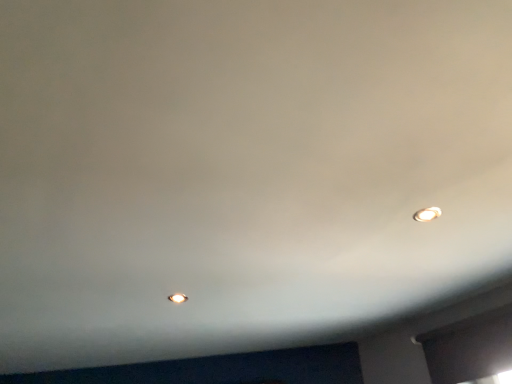
Image resolution: width=512 pixels, height=384 pixels. Describe the element at coordinates (426, 214) in the screenshot. I see `matte white light bulb at upper right, arranged as the 1th light bulb when viewed from the front` at that location.

How much space does matte white light bulb at center, which appears as the first light bulb when ordered from the bottom, occupy horizontally?

matte white light bulb at center, which appears as the first light bulb when ordered from the bottom, is 10.09 centimeters wide.

In order to face matte white light bulb at center, which ranks as the first light bulb in left-to-right order, should I rotate leftwards or rightwards?

You should rotate left by 10.010 degrees.

Find the location of a particular element. This screenshot has width=512, height=384. matte white light bulb at upper right, which is the 2th light bulb in left-to-right order is located at coordinates (x=426, y=214).

Considering the sizes of objects matte white light bulb at upper right, which appears as the second light bulb when ordered from the bottom, and transparent glass window at lower right in the image provided, who is shorter, matte white light bulb at upper right, which appears as the second light bulb when ordered from the bottom, or transparent glass window at lower right?

With less height is matte white light bulb at upper right, which appears as the second light bulb when ordered from the bottom.

Which object is positioned more to the left, matte white light bulb at upper right, the 1th light bulb positioned from the top, or transparent glass window at lower right?

matte white light bulb at upper right, the 1th light bulb positioned from the top, is more to the left.

From the image's perspective, count 2nd light bulbs upward from the transparent glass window at lower right and point to it. Please provide its 2D coordinates.

[(426, 214)]

Between matte white light bulb at center, which ranks as the 2th light bulb in front-to-back order, and matte white light bulb at upper right, arranged as the 1th light bulb when viewed from the front, which one has more height?

matte white light bulb at center, which ranks as the 2th light bulb in front-to-back order.

Considering the points (186, 296) and (426, 220), which point is in front, point (186, 296) or point (426, 220)?

Positioned in front is point (426, 220).

From a real-world perspective, who is located lower, matte white light bulb at center, which is the second light bulb in right-to-left order, or matte white light bulb at upper right, the 1th light bulb positioned from the top?

matte white light bulb at center, which is the second light bulb in right-to-left order.

Does matte white light bulb at center, acting as the 2th light bulb starting from the top, turn towards transparent glass window at lower right?

No.

Is matte white light bulb at center, the 1th light bulb positioned from the back, further to camera compared to transparent glass window at lower right?

Yes, the depth of matte white light bulb at center, the 1th light bulb positioned from the back, is greater than that of transparent glass window at lower right.

Which of these two, matte white light bulb at center, which is the second light bulb in right-to-left order, or transparent glass window at lower right, is thinner?

With smaller width is transparent glass window at lower right.

Can you confirm if matte white light bulb at center, the 1th light bulb positioned from the back, is positioned to the left of transparent glass window at lower right?

Yes.

In the scene shown: Can you confirm if transparent glass window at lower right is smaller than matte white light bulb at upper right, which appears as the second light bulb when ordered from the bottom?

No.

Can matte white light bulb at upper right, which is the 2th light bulb in left-to-right order, be found inside transparent glass window at lower right?

No.

Relative to matte white light bulb at upper right, arranged as the 1th light bulb when viewed from the front, is transparent glass window at lower right in front or behind?

transparent glass window at lower right is behind matte white light bulb at upper right, arranged as the 1th light bulb when viewed from the front.

Does transparent glass window at lower right have a greater width compared to matte white light bulb at upper right, which appears as the second light bulb when ordered from the bottom?

No, transparent glass window at lower right is not wider than matte white light bulb at upper right, which appears as the second light bulb when ordered from the bottom.

Between matte white light bulb at upper right, the 1th light bulb positioned from the top, and matte white light bulb at center, acting as the 2th light bulb starting from the top, which one appears on the left side from the viewer's perspective?

Positioned to the left is matte white light bulb at center, acting as the 2th light bulb starting from the top.

From the image's perspective, which is above, matte white light bulb at upper right, which appears as the second light bulb when ordered from the bottom, or matte white light bulb at center, which ranks as the first light bulb in left-to-right order?

matte white light bulb at upper right, which appears as the second light bulb when ordered from the bottom, from the image's perspective.

Does point (419, 214) lie behind point (178, 294)?

No.

Consider the image. Based on their sizes in the image, would you say matte white light bulb at upper right, arranged as the 1th light bulb when viewed from the front, is bigger or smaller than matte white light bulb at center, which ranks as the 2th light bulb in front-to-back order?

matte white light bulb at upper right, arranged as the 1th light bulb when viewed from the front, is bigger than matte white light bulb at center, which ranks as the 2th light bulb in front-to-back order.

Is transparent glass window at lower right far from matte white light bulb at center, acting as the 2th light bulb starting from the top?

Yes, transparent glass window at lower right and matte white light bulb at center, acting as the 2th light bulb starting from the top, are quite far apart.

Is transparent glass window at lower right outside of matte white light bulb at center, which is the second light bulb in right-to-left order?

That's correct, transparent glass window at lower right is outside of matte white light bulb at center, which is the second light bulb in right-to-left order.

Is transparent glass window at lower right facing away from matte white light bulb at center, which ranks as the first light bulb in left-to-right order?

No, transparent glass window at lower right is not facing away from matte white light bulb at center, which ranks as the first light bulb in left-to-right order.

Identify the location of the 1st light bulb to the left when counting from the transparent glass window at lower right. Image resolution: width=512 pixels, height=384 pixels. (426, 214).

The width and height of the screenshot is (512, 384). In order to click on light bulb behind the matte white light bulb at upper right, which is the first light bulb from right to left in this screenshot , I will do `click(178, 298)`.

Which object lies further to the anchor point matte white light bulb at upper right, which is the 2th light bulb in left-to-right order, matte white light bulb at center, acting as the 2th light bulb starting from the top, or transparent glass window at lower right?

Among the two, matte white light bulb at center, acting as the 2th light bulb starting from the top, is located further to matte white light bulb at upper right, which is the 2th light bulb in left-to-right order.

Consider the image. Which object lies further to the anchor point matte white light bulb at center, the 1th light bulb positioned from the back, transparent glass window at lower right or matte white light bulb at upper right, marked as the 2th light bulb in a back-to-front arrangement?

transparent glass window at lower right.

When comparing their distances from matte white light bulb at upper right, marked as the 2th light bulb in a back-to-front arrangement, does transparent glass window at lower right or matte white light bulb at center, acting as the 2th light bulb starting from the top, seem closer?

transparent glass window at lower right is positioned closer to the anchor matte white light bulb at upper right, marked as the 2th light bulb in a back-to-front arrangement.

Which object lies nearer to the anchor point transparent glass window at lower right, matte white light bulb at upper right, which is the 2th light bulb in left-to-right order, or matte white light bulb at center, which ranks as the first light bulb in left-to-right order?

Based on the image, matte white light bulb at upper right, which is the 2th light bulb in left-to-right order, appears to be nearer to transparent glass window at lower right.

From the image, which object appears to be farther from matte white light bulb at center, which appears as the first light bulb when ordered from the bottom, matte white light bulb at upper right, the 1th light bulb positioned from the top, or transparent glass window at lower right?

transparent glass window at lower right lies further to matte white light bulb at center, which appears as the first light bulb when ordered from the bottom, than the other object.

From the image, which object appears to be farther from transparent glass window at lower right, matte white light bulb at center, which is the second light bulb in right-to-left order, or matte white light bulb at upper right, which appears as the second light bulb when ordered from the bottom?

Based on the image, matte white light bulb at center, which is the second light bulb in right-to-left order, appears to be further to transparent glass window at lower right.

Find the location of `light bulb between matte white light bulb at center, which ranks as the 2th light bulb in front-to-back order, and transparent glass window at lower right, in the horizontal direction`. light bulb between matte white light bulb at center, which ranks as the 2th light bulb in front-to-back order, and transparent glass window at lower right, in the horizontal direction is located at coordinates (426, 214).